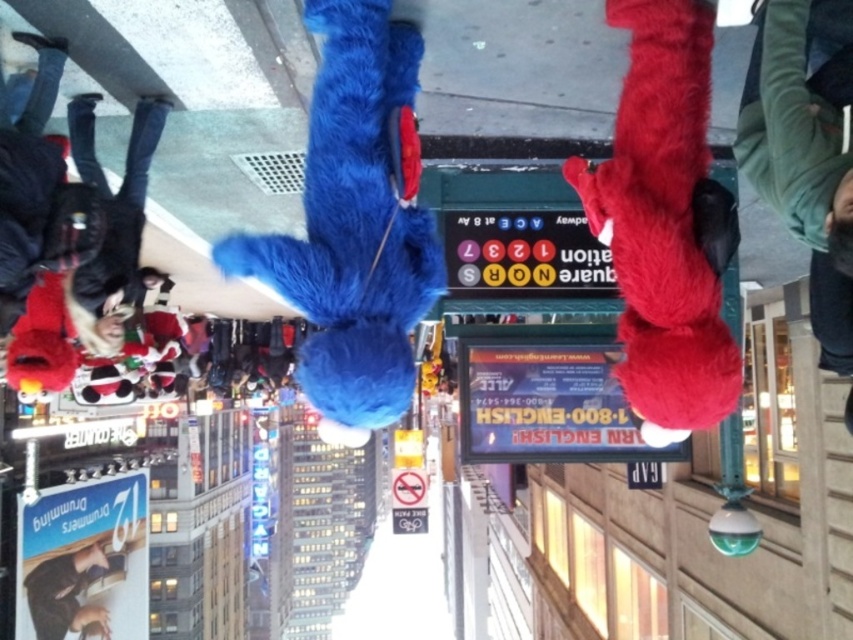
Question: Among these objects, which one is nearest to the camera?

Choices:
 (A) fuzzy blue plush at center
 (B) smooth black phone at lower left

Answer: (A)

Question: Considering the real-world distances, which object is farthest from the smooth black phone at lower left?

Choices:
 (A) fluffy red hand at right
 (B) fuzzy blue plush at center

Answer: (A)

Question: Can you confirm if fuzzy blue plush at center is positioned below fluffy red hand at right?

Choices:
 (A) yes
 (B) no

Answer: (B)

Question: Does fuzzy blue plush at center appear under smooth black phone at lower left?

Choices:
 (A) yes
 (B) no

Answer: (B)

Question: Which point is closer to the camera?

Choices:
 (A) (49, 624)
 (B) (676, 381)
 (C) (825, 305)
 (D) (351, 422)

Answer: (B)

Question: Does green fuzzy sweater at upper right have a lesser width compared to smooth black phone at lower left?

Choices:
 (A) yes
 (B) no

Answer: (A)